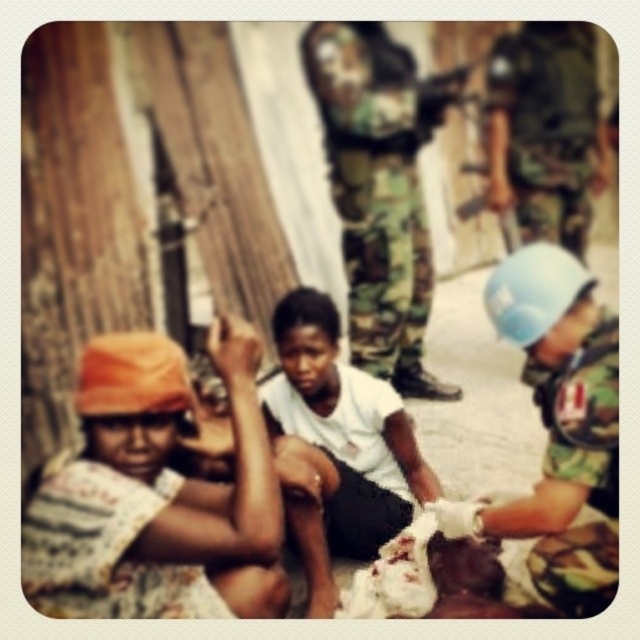
Question: Is striped fabric headscarf at left smaller than white matte shirt at center?

Choices:
 (A) no
 (B) yes

Answer: (A)

Question: Does striped fabric headscarf at left appear over camouflage uniform at lower right?

Choices:
 (A) no
 (B) yes

Answer: (A)

Question: Which point is farther to the camera?

Choices:
 (A) camouflage uniform at center
 (B) camouflage uniform at lower right
 (C) camouflage uniform at right

Answer: (B)

Question: Which of the following is the closest to the observer?

Choices:
 (A) camouflage uniform at center
 (B) camouflage uniform at lower right
 (C) striped fabric headscarf at left
 (D) woven fabric hat at lower left

Answer: (A)

Question: Is striped fabric headscarf at left wider than camouflage uniform at lower right?

Choices:
 (A) no
 (B) yes

Answer: (B)

Question: Which point is farther to the camera?

Choices:
 (A) [x=524, y=154]
 (B) [x=353, y=195]

Answer: (B)